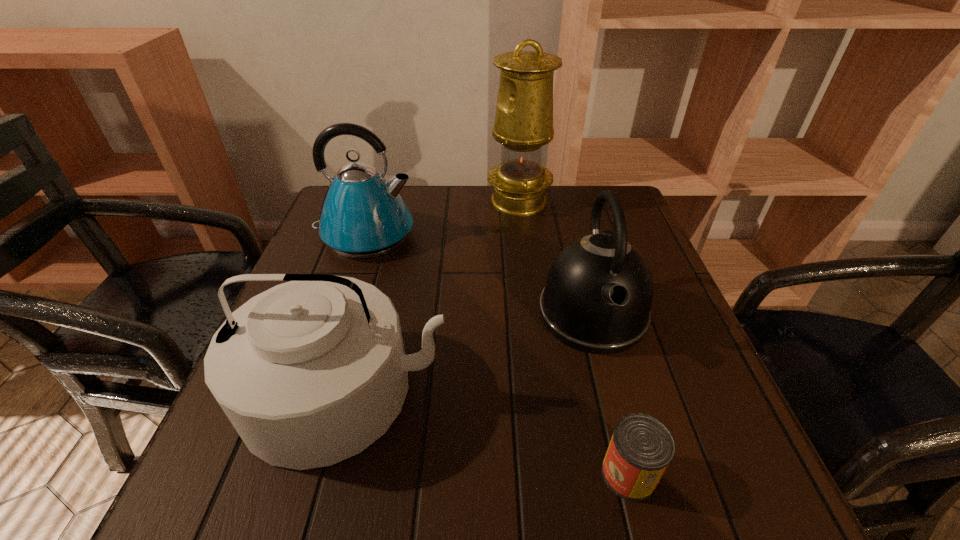
Locate an element on the screen. Image resolution: width=960 pixels, height=540 pixels. the tallest object is located at coordinates (523, 123).

Where is `the farthest kettle`? The height and width of the screenshot is (540, 960). the farthest kettle is located at coordinates (363, 215).

This screenshot has height=540, width=960. I want to click on the rightmost kettle, so [599, 290].

You are a GUI agent. You are given a task and a screenshot of the screen. Output one action in this format:
    pyautogui.click(x=<x>, y=<y>)
    Task: Click on the can
    
    Given the screenshot: What is the action you would take?
    pyautogui.click(x=641, y=448)

The image size is (960, 540). Find the location of `free space located on the right of the oil lamp`. free space located on the right of the oil lamp is located at coordinates (627, 201).

This screenshot has height=540, width=960. Find the location of `free space located at the spout of the farthest kettle`. free space located at the spout of the farthest kettle is located at coordinates (520, 235).

At what (x,y) coordinates should I click in order to perform the action: click on vacant space located on the spout of the rightmost kettle. Please return your answer as a coordinate pair (x, y). This screenshot has width=960, height=540. Looking at the image, I should click on (615, 400).

Locate an element on the screen. The image size is (960, 540). free space located on the left of the shortest object is located at coordinates (336, 474).

Where is `oil lamp located in the far edge section of the desktop`? This screenshot has width=960, height=540. oil lamp located in the far edge section of the desktop is located at coordinates (x=523, y=123).

Find the location of a particular element. kettle that is at the far edge is located at coordinates [363, 215].